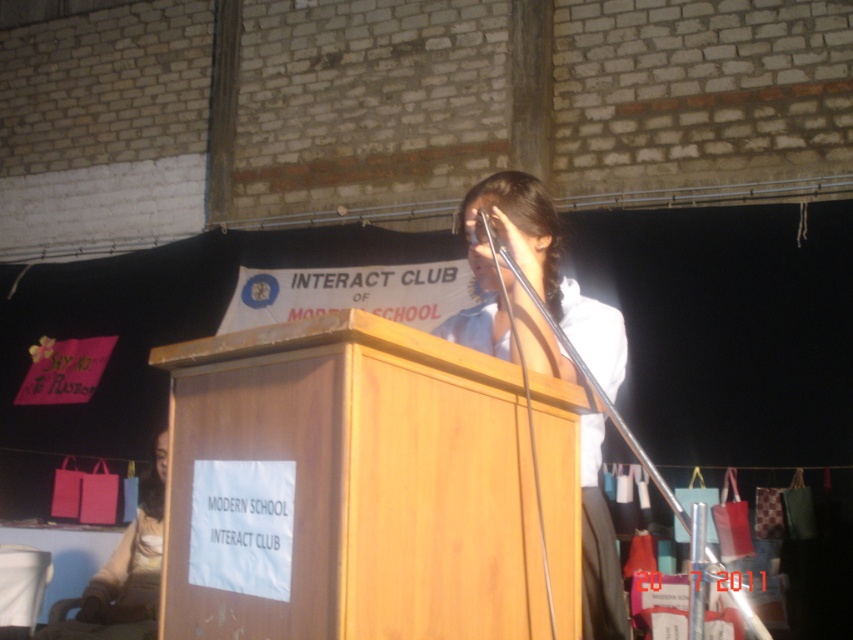
Who is taller, white glossy shirt at center or metallic shiny microphone at upper center?

With more height is white glossy shirt at center.

The height and width of the screenshot is (640, 853). I want to click on white glossy shirt at center, so pos(532,289).